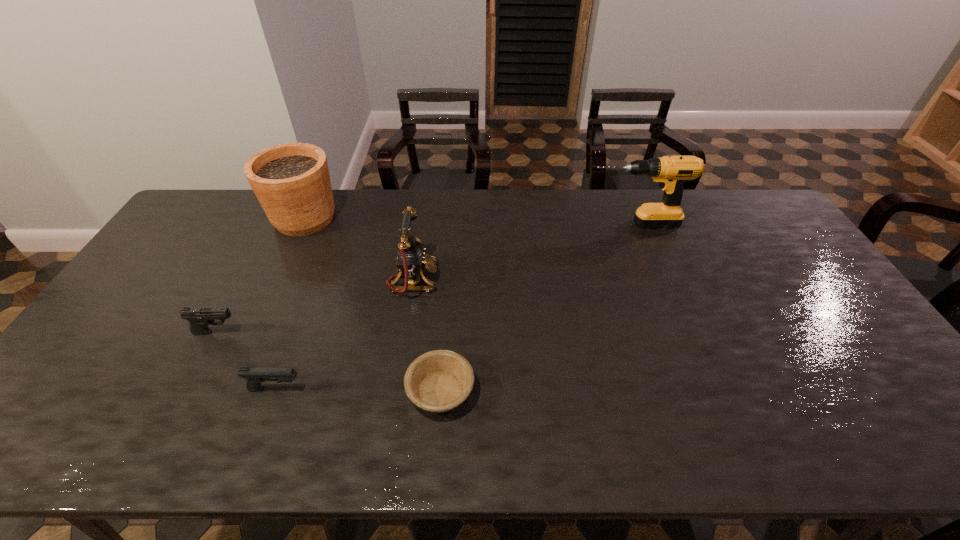
Locate an element on the screen. the rightmost object is located at coordinates (671, 172).

Where is `flowerpot`? Image resolution: width=960 pixels, height=540 pixels. flowerpot is located at coordinates (291, 181).

Image resolution: width=960 pixels, height=540 pixels. In order to click on telephone in this screenshot , I will do `click(411, 256)`.

This screenshot has height=540, width=960. I want to click on the fourth farthest object, so click(199, 318).

Image resolution: width=960 pixels, height=540 pixels. What are the coordinates of `the farther pistol` in the screenshot? It's located at [x=199, y=318].

The height and width of the screenshot is (540, 960). Find the location of `the nearer pistol`. the nearer pistol is located at coordinates (255, 376).

This screenshot has width=960, height=540. Find the location of `the shortest object`. the shortest object is located at coordinates (438, 381).

The height and width of the screenshot is (540, 960). What are the coordinates of `vacant space located at the tip of the rightmost object` in the screenshot? It's located at (478, 224).

You are a GUI agent. You are given a task and a screenshot of the screen. Output one action in this format:
    pyautogui.click(x=<x>, y=<y>)
    Task: Click on the vacant space located at the tip of the rightmost object
    
    Given the screenshot: What is the action you would take?
    pyautogui.click(x=518, y=224)

I want to click on vacant space located at the tip of the rightmost object, so click(x=524, y=224).